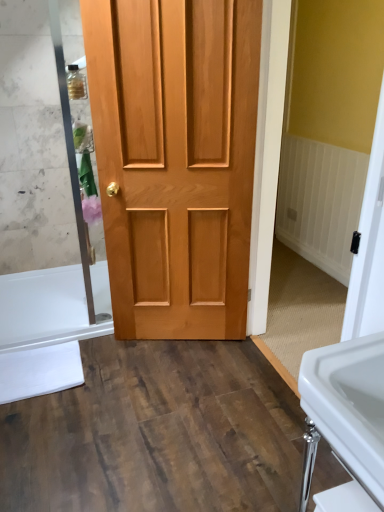
You are a GUI agent. You are given a task and a screenshot of the screen. Output one action in this format:
    pyautogui.click(x=<x>, y=<y>)
    Task: Click on the natural wood door at center
    The width and height of the screenshot is (384, 512).
    Given the screenshot: What is the action you would take?
    pyautogui.click(x=175, y=159)

Are white glossy sink at lower right and natural wood door at center making contact?

white glossy sink at lower right and natural wood door at center are not in contact.

Considering the positions of point (369, 358) and point (126, 9), is point (369, 358) closer or farther from the camera than point (126, 9)?

Point (369, 358) is closer to the camera than point (126, 9).

Can you tell me how much white glossy sink at lower right and natural wood door at center differ in facing direction?

There is a 67.8-degree angle between the facing directions of white glossy sink at lower right and natural wood door at center.

Is white glossy sink at lower right further to camera compared to natural wood door at center?

No, white glossy sink at lower right is closer to the camera.

Is white glossy bathtub at lower left directly adjacent to white glossy sink at lower right?

No, white glossy bathtub at lower left is not next to white glossy sink at lower right.

Considering the sizes of objects white glossy bathtub at lower left and white glossy sink at lower right in the image provided, who is smaller, white glossy bathtub at lower left or white glossy sink at lower right?

white glossy bathtub at lower left is smaller.

Does white glossy bathtub at lower left turn towards white glossy sink at lower right?

No, white glossy bathtub at lower left is not turned towards white glossy sink at lower right.

Is white glossy bathtub at lower left in front of white glossy sink at lower right?

No, it is behind white glossy sink at lower right.

Can you confirm if natural wood door at center is shorter than white glossy bathtub at lower left?

No, natural wood door at center is not shorter than white glossy bathtub at lower left.

Does natural wood door at center have a larger size compared to white glossy bathtub at lower left?

Correct, natural wood door at center is larger in size than white glossy bathtub at lower left.

Could you tell me if natural wood door at center is turned towards white glossy bathtub at lower left?

No, natural wood door at center is not aimed at white glossy bathtub at lower left.

Looking at this image, is the depth of natural wood door at center less than that of white glossy bathtub at lower left?

Yes, natural wood door at center is in front of white glossy bathtub at lower left.

Is the surface of white glossy bathtub at lower left in direct contact with natural wood door at center?

No, white glossy bathtub at lower left is not touching natural wood door at center.

Looking at this image, from a real-world perspective, which is physically above, white glossy bathtub at lower left or natural wood door at center?

From a 3D spatial view, natural wood door at center is above.

Is white glossy bathtub at lower left spatially inside natural wood door at center, or outside of it?

white glossy bathtub at lower left cannot be found inside natural wood door at center.

From the image's perspective, does white glossy bathtub at lower left appear higher than natural wood door at center?

No.

Is natural wood door at center to the right of white glossy sink at lower right from the viewer's perspective?

No.

Which object is thinner, natural wood door at center or white glossy sink at lower right?

Thinner between the two is natural wood door at center.

Does natural wood door at center have a greater height compared to white glossy sink at lower right?

Correct, natural wood door at center is much taller as white glossy sink at lower right.

Is white glossy sink at lower right at the back of natural wood door at center?

No, natural wood door at center is not facing the opposite direction of white glossy sink at lower right.

How many degrees apart are the facing directions of white glossy sink at lower right and white glossy bathtub at lower left?

There is a 88.5-degree angle between the facing directions of white glossy sink at lower right and white glossy bathtub at lower left.

Does point (337, 387) come behind point (27, 397)?

No, (337, 387) is closer to viewer.

Considering the relative sizes of white glossy sink at lower right and white glossy bathtub at lower left in the image provided, is white glossy sink at lower right bigger than white glossy bathtub at lower left?

Yes.

Is white glossy sink at lower right touching white glossy bathtub at lower left?

No, white glossy sink at lower right is not next to white glossy bathtub at lower left.

Locate an element on the screen. door above the white glossy sink at lower right (from the image's perspective) is located at coordinates (175, 159).

Image resolution: width=384 pixels, height=512 pixels. Identify the location of bath on the left side of white glossy sink at lower right. coord(48,328).

From the image, which object appears to be farther from white glossy sink at lower right, white glossy bathtub at lower left or natural wood door at center?

The object further to white glossy sink at lower right is white glossy bathtub at lower left.

When comparing their distances from white glossy sink at lower right, does natural wood door at center or white glossy bathtub at lower left seem further?

Among the two, white glossy bathtub at lower left is located further to white glossy sink at lower right.

Looking at the image, which one is located further to natural wood door at center, white glossy bathtub at lower left or white glossy sink at lower right?

Based on the image, white glossy sink at lower right appears to be further to natural wood door at center.

Looking at the image, which one is located further to natural wood door at center, white glossy sink at lower right or white glossy bathtub at lower left?

The object further to natural wood door at center is white glossy sink at lower right.

When comparing their distances from white glossy bathtub at lower left, does white glossy sink at lower right or natural wood door at center seem closer?

natural wood door at center is positioned closer to the anchor white glossy bathtub at lower left.

In the scene shown: Which object lies nearer to the anchor point white glossy bathtub at lower left, natural wood door at center or white glossy sink at lower right?

natural wood door at center is positioned closer to the anchor white glossy bathtub at lower left.

At what (x,y) coordinates should I click in order to perform the action: click on door positioned between white glossy sink at lower right and white glossy bathtub at lower left from near to far. Please return your answer as a coordinate pair (x, y). The image size is (384, 512). Looking at the image, I should click on (175, 159).